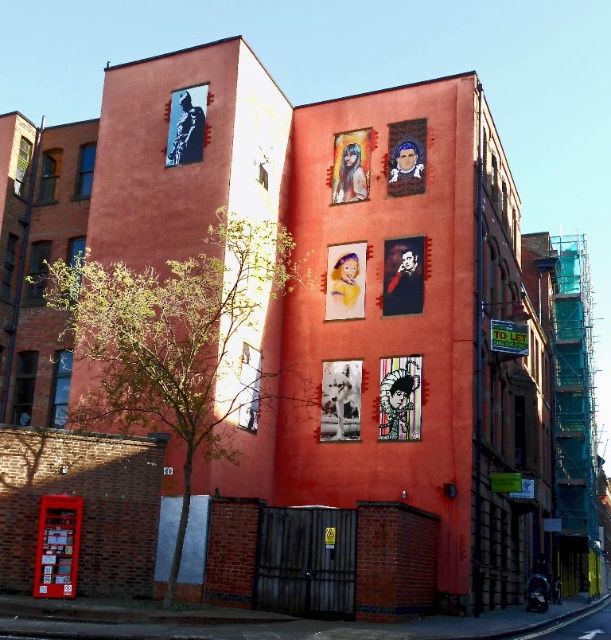
Does white paper poster at center have a smaller size compared to matte paper poster at upper center?

Indeed, white paper poster at center has a smaller size compared to matte paper poster at upper center.

Consider the image. Can you confirm if white paper poster at center is bigger than matte paper poster at upper center?

No.

Between point (353, 432) and point (353, 136), which one is positioned in front?

Point (353, 432)

Image resolution: width=611 pixels, height=640 pixels. What are the coordinates of `white paper poster at center` in the screenshot? It's located at (340, 401).

Does colorful paper poster at center have a lesser width compared to pastel yellow paper at center?

Indeed, colorful paper poster at center has a lesser width compared to pastel yellow paper at center.

In order to click on colorful paper poster at center in this screenshot , I will do `click(400, 397)`.

Between colorful paper poster at center and matte paper poster at upper center, which one is positioned higher?

Positioned higher is matte paper poster at upper center.

In the scene shown: Does colorful paper poster at center have a greater height compared to matte paper poster at upper center?

No.

This screenshot has width=611, height=640. Describe the element at coordinates (400, 397) in the screenshot. I see `colorful paper poster at center` at that location.

The height and width of the screenshot is (640, 611). Find the location of `colorful paper poster at center`. colorful paper poster at center is located at coordinates (400, 397).